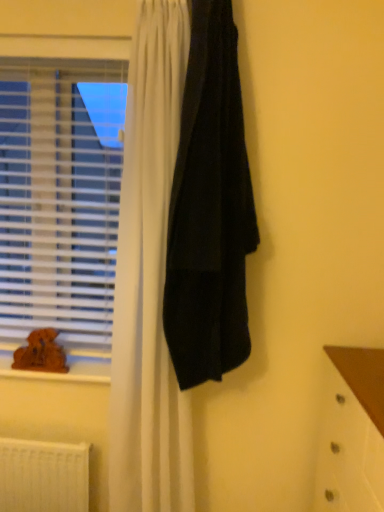
Question: From a real-world perspective, is brown plush toy at lower left over black matte towel at center?

Choices:
 (A) yes
 (B) no

Answer: (B)

Question: From the image's perspective, would you say brown plush toy at lower left is shown under black matte towel at center?

Choices:
 (A) no
 (B) yes

Answer: (B)

Question: Is there a large distance between brown plush toy at lower left and black matte towel at center?

Choices:
 (A) yes
 (B) no

Answer: (B)

Question: Can you confirm if brown plush toy at lower left is wider than black matte towel at center?

Choices:
 (A) no
 (B) yes

Answer: (A)

Question: From the image's perspective, would you say brown plush toy at lower left is positioned over black matte towel at center?

Choices:
 (A) no
 (B) yes

Answer: (A)

Question: Based on their sizes in the image, would you say brown wood at lower left is bigger or smaller than brown plush toy at lower left?

Choices:
 (A) small
 (B) big

Answer: (B)

Question: Is point (9, 352) positioned closer to the camera than point (18, 361)?

Choices:
 (A) closer
 (B) farther

Answer: (B)

Question: From the image's perspective, is brown wood at lower left above or below brown plush toy at lower left?

Choices:
 (A) above
 (B) below

Answer: (B)

Question: In terms of width, does brown wood at lower left look wider or thinner when compared to brown plush toy at lower left?

Choices:
 (A) thin
 (B) wide

Answer: (B)

Question: Is white plastic blinds at left situated inside black matte towel at center or outside?

Choices:
 (A) inside
 (B) outside

Answer: (B)

Question: Considering their positions, is white plastic blinds at left located in front of or behind black matte towel at center?

Choices:
 (A) front
 (B) behind

Answer: (B)

Question: In terms of size, does white plastic blinds at left appear bigger or smaller than black matte towel at center?

Choices:
 (A) big
 (B) small

Answer: (B)

Question: From a real-world perspective, is white plastic blinds at left above or below black matte towel at center?

Choices:
 (A) below
 (B) above

Answer: (A)

Question: From their relative heights in the image, would you say white plastic radiator at lower left is taller or shorter than black matte towel at center?

Choices:
 (A) tall
 (B) short

Answer: (B)

Question: Is point (39, 482) closer or farther from the camera than point (205, 93)?

Choices:
 (A) closer
 (B) farther

Answer: (B)